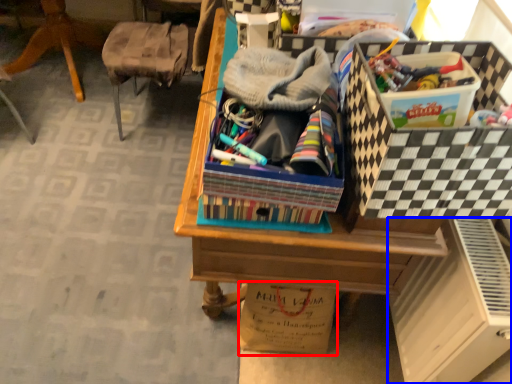
Question: Which point is closer to the camera, cardboard box (highlighted by a red box) or file cabinet (highlighted by a blue box)?

Choices:
 (A) cardboard box
 (B) file cabinet

Answer: (B)